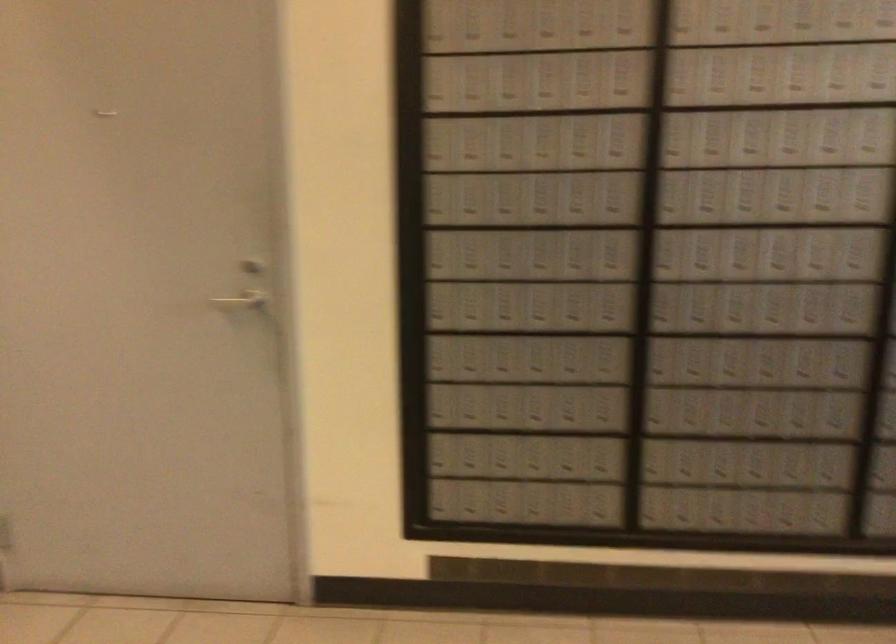
Image resolution: width=896 pixels, height=644 pixels. Describe the element at coordinates (242, 299) in the screenshot. I see `a white door handle` at that location.